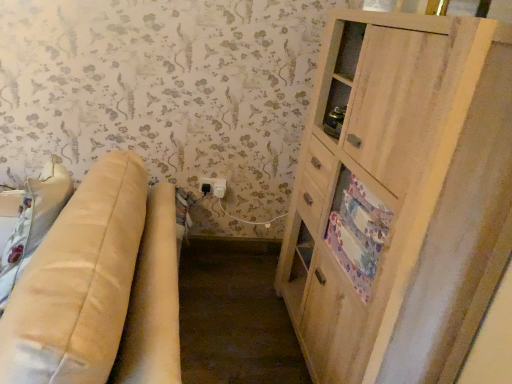
Question: Should I look upward or downward to see light wood cabinet at right?

Choices:
 (A) up
 (B) down

Answer: (B)

Question: From the image's perspective, does beige leather couch at left appear higher than black plastic electric outlet at lower center?

Choices:
 (A) yes
 (B) no

Answer: (B)

Question: Does beige leather couch at left lie in front of black plastic electric outlet at lower center?

Choices:
 (A) yes
 (B) no

Answer: (A)

Question: From the image's perspective, is beige leather couch at left located beneath black plastic electric outlet at lower center?

Choices:
 (A) yes
 (B) no

Answer: (A)

Question: Is beige leather couch at left directly adjacent to black plastic electric outlet at lower center?

Choices:
 (A) yes
 (B) no

Answer: (B)

Question: From a real-world perspective, is beige leather couch at left over black plastic electric outlet at lower center?

Choices:
 (A) yes
 (B) no

Answer: (B)

Question: Is beige leather couch at left thinner than black plastic electric outlet at lower center?

Choices:
 (A) yes
 (B) no

Answer: (B)

Question: Is black plastic electric outlet at lower center located outside light wood cabinet at right?

Choices:
 (A) yes
 (B) no

Answer: (A)

Question: Is black plastic electric outlet at lower center at the right side of light wood cabinet at right?

Choices:
 (A) no
 (B) yes

Answer: (A)

Question: From a real-world perspective, is black plastic electric outlet at lower center on top of light wood cabinet at right?

Choices:
 (A) no
 (B) yes

Answer: (A)

Question: Is black plastic electric outlet at lower center aimed at light wood cabinet at right?

Choices:
 (A) yes
 (B) no

Answer: (B)

Question: Can you confirm if black plastic electric outlet at lower center is wider than light wood cabinet at right?

Choices:
 (A) yes
 (B) no

Answer: (B)

Question: From the image's perspective, is black plastic electric outlet at lower center over light wood cabinet at right?

Choices:
 (A) no
 (B) yes

Answer: (B)

Question: Is beige leather couch at left further to the viewer compared to light wood cabinet at right?

Choices:
 (A) no
 (B) yes

Answer: (A)